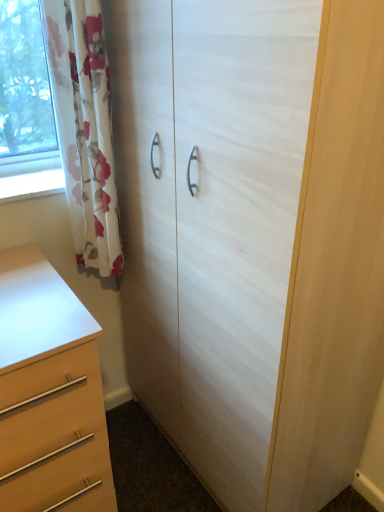
Question: Can we say white wood cupboard at center lies outside matte wood chest of drawers at lower left?

Choices:
 (A) no
 (B) yes

Answer: (B)

Question: Does white wood cupboard at center have a lesser height compared to matte wood chest of drawers at lower left?

Choices:
 (A) no
 (B) yes

Answer: (A)

Question: Is white wood cupboard at center with matte wood chest of drawers at lower left?

Choices:
 (A) no
 (B) yes

Answer: (A)

Question: Is matte wood chest of drawers at lower left at the back of white wood cupboard at center?

Choices:
 (A) yes
 (B) no

Answer: (B)

Question: From the image's perspective, is white wood cupboard at center below matte wood chest of drawers at lower left?

Choices:
 (A) yes
 (B) no

Answer: (B)

Question: Is white wood cupboard at center bigger than matte wood chest of drawers at lower left?

Choices:
 (A) yes
 (B) no

Answer: (A)

Question: Is floral fabric curtain at left behind matte wood chest of drawers at lower left?

Choices:
 (A) no
 (B) yes

Answer: (B)

Question: Is matte wood chest of drawers at lower left a part of floral fabric curtain at left?

Choices:
 (A) no
 (B) yes

Answer: (A)

Question: Is floral fabric curtain at left far away from matte wood chest of drawers at lower left?

Choices:
 (A) no
 (B) yes

Answer: (A)

Question: Are floral fabric curtain at left and matte wood chest of drawers at lower left making contact?

Choices:
 (A) yes
 (B) no

Answer: (B)

Question: Can you confirm if floral fabric curtain at left is wider than matte wood chest of drawers at lower left?

Choices:
 (A) yes
 (B) no

Answer: (B)

Question: From the image's perspective, would you say floral fabric curtain at left is shown under matte wood chest of drawers at lower left?

Choices:
 (A) yes
 (B) no

Answer: (B)

Question: Is floral fabric curtain at left positioned with its back to white wood cupboard at center?

Choices:
 (A) no
 (B) yes

Answer: (A)